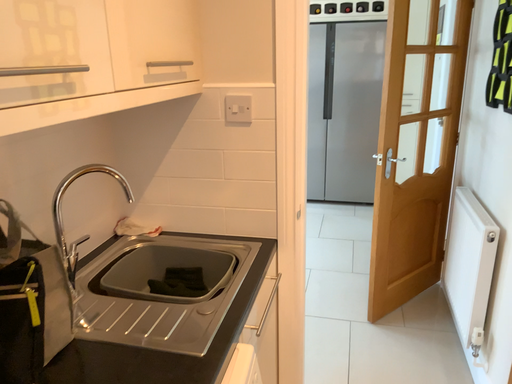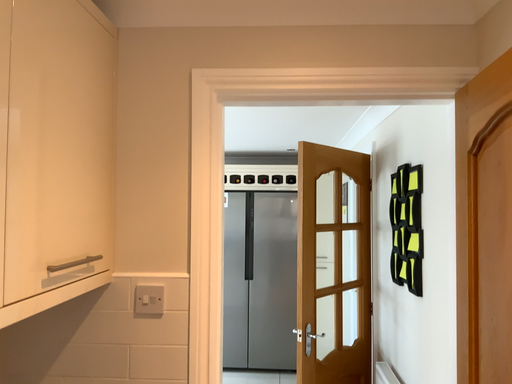
Question: Which way did the camera rotate in the video?

Choices:
 (A) rotated upward
 (B) rotated downward

Answer: (A)